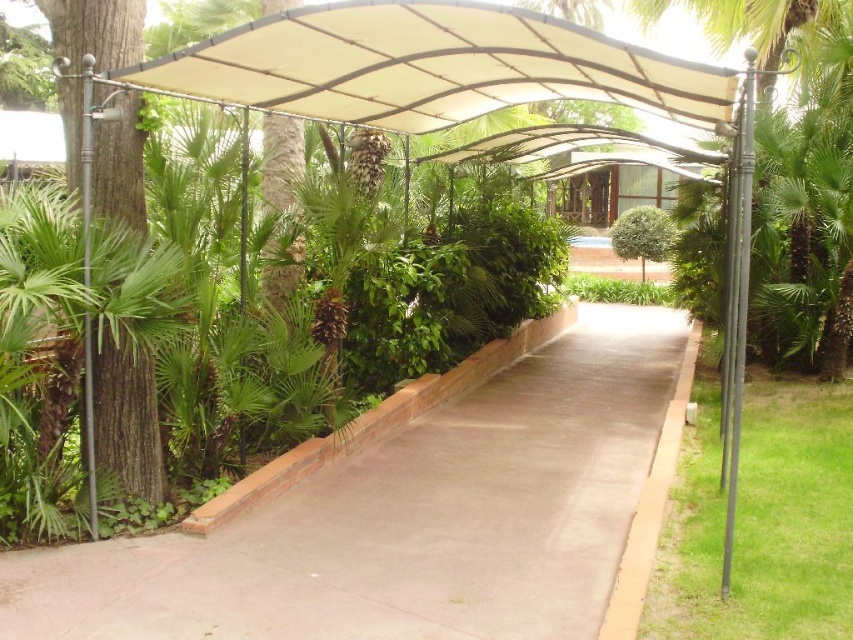
Question: Which object appears farthest from the camera in this image?

Choices:
 (A) concrete at center
 (B) brown rough tree at left

Answer: (B)

Question: Does concrete at center appear on the left side of brown rough tree at left?

Choices:
 (A) yes
 (B) no

Answer: (B)

Question: Which of the following is the closest to the observer?

Choices:
 (A) concrete at center
 (B) brown rough tree at left

Answer: (A)

Question: Is concrete at center further to camera compared to brown rough tree at left?

Choices:
 (A) no
 (B) yes

Answer: (A)

Question: Is concrete at center below brown rough tree at left?

Choices:
 (A) no
 (B) yes

Answer: (B)